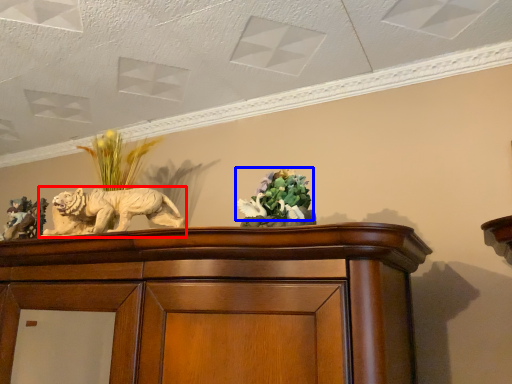
Question: Which object is closer to the camera taking this photo, lion (highlighted by a red box) or flower (highlighted by a blue box)?

Choices:
 (A) lion
 (B) flower

Answer: (B)